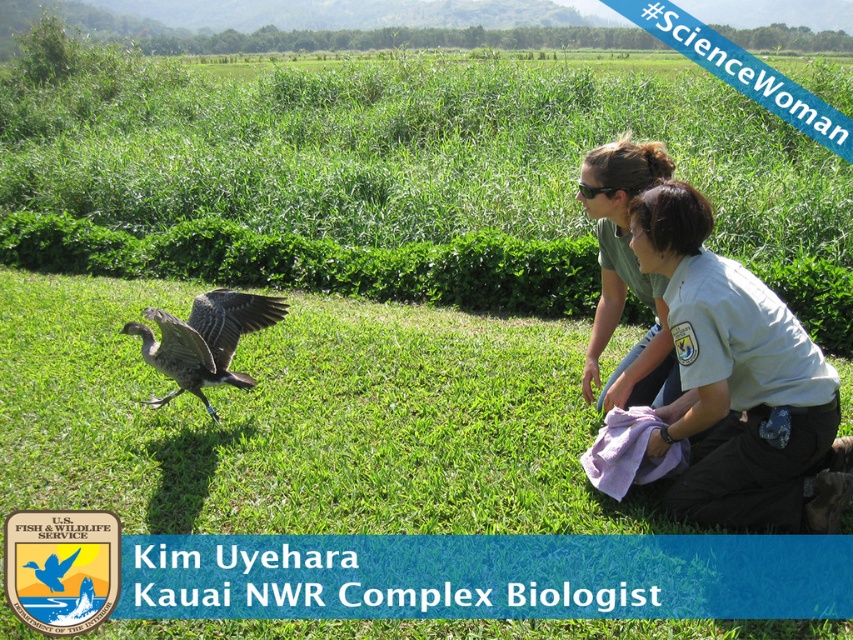
Question: Which point is farther from the camera taking this photo?

Choices:
 (A) (735, 524)
 (B) (625, 353)
 (C) (192, 317)

Answer: (B)

Question: Which of the following is the farthest from the observer?

Choices:
 (A) gray feathered goose at center
 (B) green matte shirt at center
 (C) light gray uniform at center

Answer: (A)

Question: Considering the real-world distances, which object is closest to the gray feathered goose at center?

Choices:
 (A) green matte shirt at center
 (B) light gray uniform at center

Answer: (A)

Question: Can you confirm if light gray uniform at center is positioned above green matte shirt at center?

Choices:
 (A) yes
 (B) no

Answer: (B)

Question: Does light gray uniform at center appear under green matte shirt at center?

Choices:
 (A) no
 (B) yes

Answer: (B)

Question: Can you confirm if green matte shirt at center is bigger than gray feathered goose at center?

Choices:
 (A) no
 (B) yes

Answer: (B)